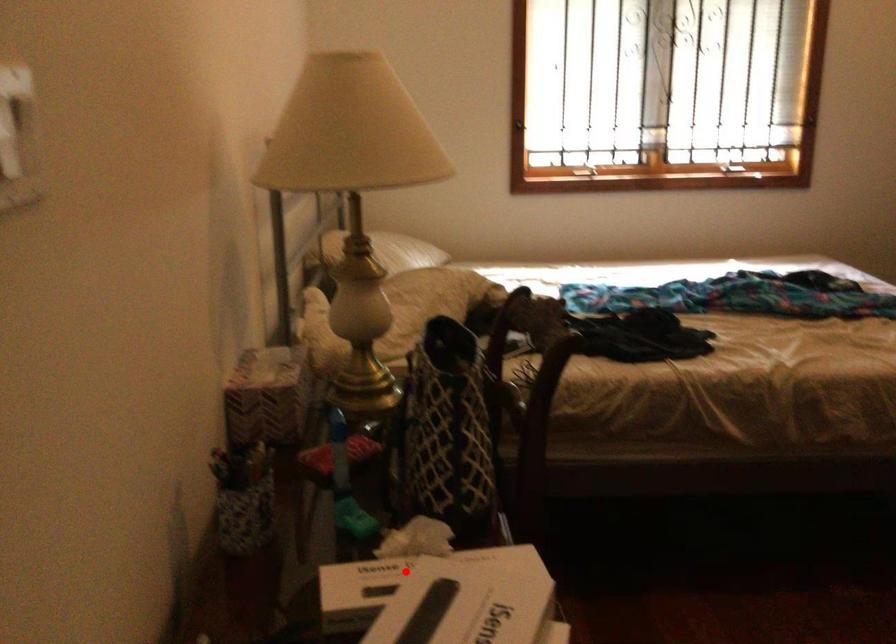
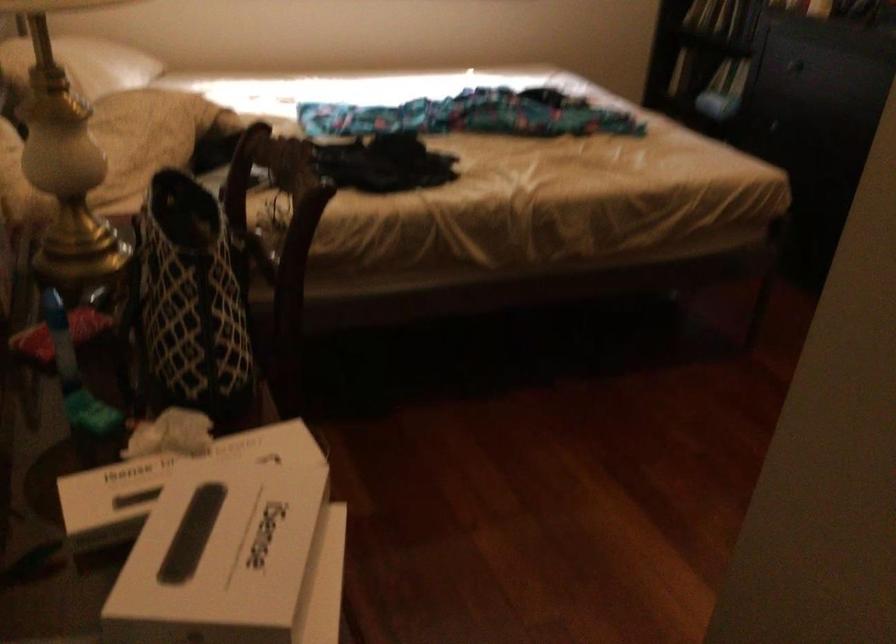
Question: I am providing you with two images of the same scene from different viewpoints. A red point is shown in image1. For the corresponding object point in image2, is it positioned nearer or farther from the camera?

Choices:
 (A) Nearer
 (B) Farther

Answer: (A)